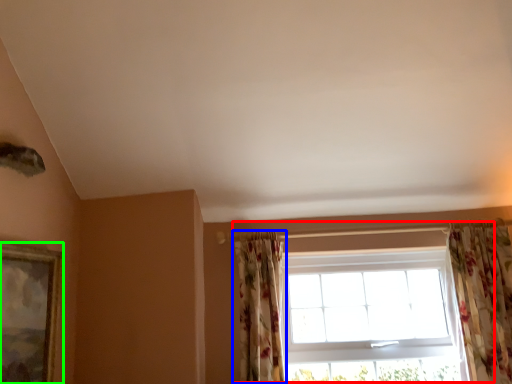
Question: Considering the real-world distances, which object is farthest from window (highlighted by a red box)? curtain (highlighted by a blue box) or picture frame (highlighted by a green box)?

Choices:
 (A) curtain
 (B) picture frame

Answer: (B)